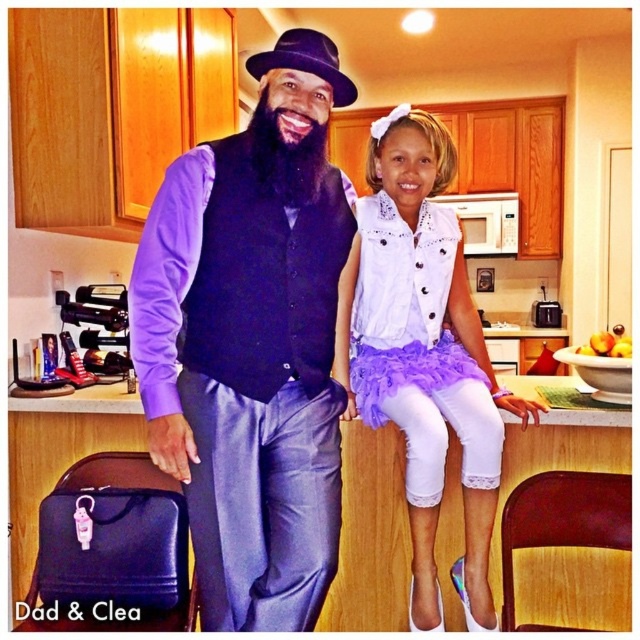
Based on the coordinates provided in the scene description, where is the white tulle skirt at center located in the image?

The white tulle skirt at center is located at the coordinates point (422,353).

You are standing in the kitchen and notice the matte black vest at center and the white tulle skirt at center. Which one appears nearer to you?

The matte black vest at center is closer to the viewer than the white tulle skirt at center.